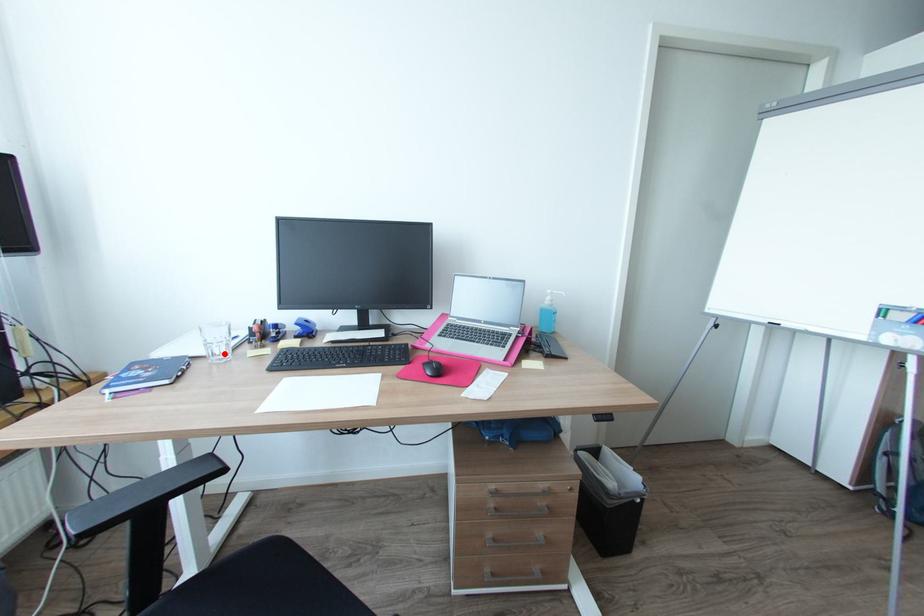
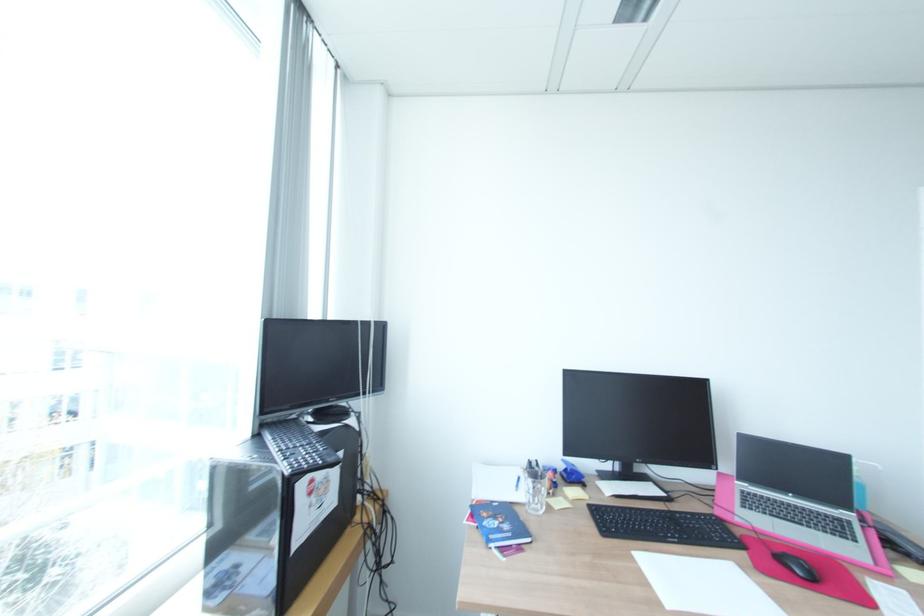
The point at the highlighted location is marked in the first image. Where is the corresponding point in the second image?

(541, 505)